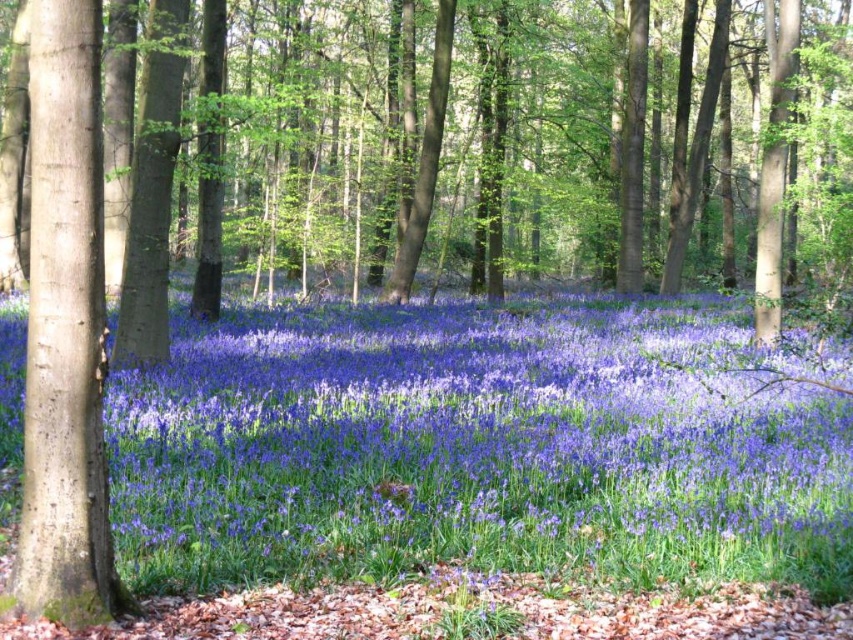
You are a hiker walking along a forest path and notice a purple matte flower at center and a smooth brown tree trunk at left. Which object is closer to you as you stand in the middle of the path?

The purple matte flower at center is closer to you than the smooth brown tree trunk at left because it is positioned further to the viewer.

Based on the photo, you are a botanist studying the spatial distribution of flowers in this forest. You notice a purple matte flower at center. Can you determine its exact coordinates in the scene?

The purple matte flower at center is located at coordinates point (479, 445).

You are standing in the middle of the forest scene described. There is a purple matte flower at center. Can you tell me what is located at the coordinates point (479, 445)?

At point (479, 445) lies purple matte flower at center.